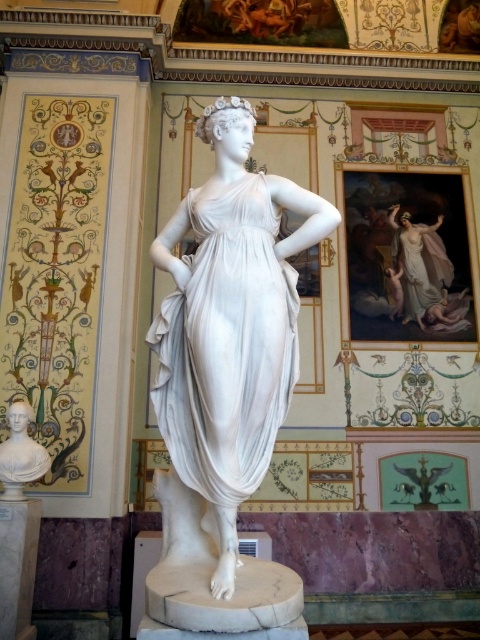
You are an art conservator examining the statue from the front. You notice two points marked on the statue, one at point (12,577) and the other at point (2,468). Which point is nearer to your current viewpoint?

Point (12,577) is closer to the camera than point (2,468).

You are standing in front of the white marble pillar at lower left and want to see the white marble statue at center. In which direction should you turn your head to look at the statue?

The white marble statue at center is to the right of the white marble pillar at lower left, so you should turn your head to the right to look at the statue.